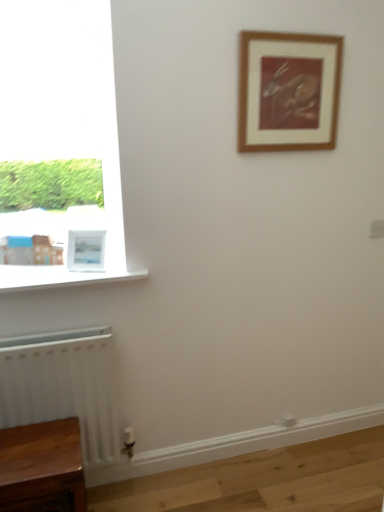
How much space does white matte picture frame at lower left, which is the first picture frame from bottom to top, occupy horizontally?

white matte picture frame at lower left, which is the first picture frame from bottom to top, is 3.53 inches in width.

At what (x,y) coordinates should I click in order to perform the action: click on white matte radiator at lower left. Please return your answer as a coordinate pair (x, y). This screenshot has width=384, height=512. Looking at the image, I should click on (62, 386).

In the scene shown: Measure the distance between wooden table at lower left and camera.

The distance of wooden table at lower left from camera is 4.56 feet.

Identify the location of wooden framed print at upper center, arranged as the 2th picture frame when viewed from the left. (288, 91).

Is wooden framed print at upper center, acting as the first picture frame starting from the top, positioned behind wooden table at lower left?

Yes, it is.

How many degrees apart are the facing directions of wooden framed print at upper center, the first picture frame from the right, and wooden table at lower left?

There is a 0.337-degree angle between the facing directions of wooden framed print at upper center, the first picture frame from the right, and wooden table at lower left.

Who is taller, wooden framed print at upper center, acting as the first picture frame starting from the top, or wooden table at lower left?

wooden table at lower left is taller.

Considering the relative sizes of wooden framed print at upper center, acting as the first picture frame starting from the top, and wooden table at lower left in the image provided, is wooden framed print at upper center, acting as the first picture frame starting from the top, bigger than wooden table at lower left?

Incorrect, wooden framed print at upper center, acting as the first picture frame starting from the top, is not larger than wooden table at lower left.

Measure the distance between white matte radiator at lower left and white glossy window sill at lower left.

white matte radiator at lower left is 14.60 inches from white glossy window sill at lower left.

Would you say white glossy window sill at lower left is part of white matte radiator at lower left's contents?

No, white glossy window sill at lower left is not a part of white matte radiator at lower left.

Is white matte radiator at lower left oriented towards white glossy window sill at lower left?

No, white matte radiator at lower left is not facing towards white glossy window sill at lower left.

How much distance is there between wooden table at lower left and white matte radiator at lower left?

The distance of wooden table at lower left from white matte radiator at lower left is 20.95 centimeters.

In order to click on furniture directly beneath the white matte radiator at lower left (from a real-world perspective) in this screenshot , I will do `click(42, 468)`.

Who is shorter, wooden table at lower left or white matte radiator at lower left?

wooden table at lower left is shorter.

Based on their positions, is wooden table at lower left located to the left or right of white matte radiator at lower left?

Clearly, wooden table at lower left is on the left of white matte radiator at lower left in the image.

Would you say white matte picture frame at lower left, the second picture frame viewed from the top, is part of white matte radiator at lower left's contents?

No.

Are white matte radiator at lower left and white matte picture frame at lower left, acting as the 1th picture frame starting from the left, beside each other?

No, white matte radiator at lower left is not making contact with white matte picture frame at lower left, acting as the 1th picture frame starting from the left.

Is white matte picture frame at lower left, acting as the 1th picture frame starting from the left, at the back of white matte radiator at lower left?

That's not correct — white matte radiator at lower left is not looking away from white matte picture frame at lower left, acting as the 1th picture frame starting from the left.

How many degrees apart are the facing directions of white matte radiator at lower left and white matte picture frame at lower left, which is the second picture frame from right to left?

The angle between the facing direction of white matte radiator at lower left and the facing direction of white matte picture frame at lower left, which is the second picture frame from right to left, is 21.5 degrees.

Which is more to the left, white matte picture frame at lower left, which is the second picture frame from right to left, or wooden table at lower left?

From the viewer's perspective, wooden table at lower left appears more on the left side.

From the image's perspective, between white matte picture frame at lower left, which is the first picture frame from bottom to top, and wooden table at lower left, which one is located above?

white matte picture frame at lower left, which is the first picture frame from bottom to top, from the image's perspective.

Looking at this image, does white matte picture frame at lower left, which is the second picture frame from right to left, turn towards wooden table at lower left?

No, white matte picture frame at lower left, which is the second picture frame from right to left, is not facing towards wooden table at lower left.

Which of these two, white matte picture frame at lower left, acting as the 1th picture frame starting from the left, or wooden table at lower left, stands taller?

With more height is wooden table at lower left.

Is white matte picture frame at lower left, which is the first picture frame from bottom to top, located within wooden framed print at upper center, arranged as the 2th picture frame when viewed from the left?

No, wooden framed print at upper center, arranged as the 2th picture frame when viewed from the left, does not contain white matte picture frame at lower left, which is the first picture frame from bottom to top.

Considering their positions, is wooden framed print at upper center, acting as the 2th picture frame starting from the bottom, located in front of or behind white matte picture frame at lower left, acting as the 1th picture frame starting from the left?

wooden framed print at upper center, acting as the 2th picture frame starting from the bottom, is in front of white matte picture frame at lower left, acting as the 1th picture frame starting from the left.

From a real-world perspective, relative to white matte picture frame at lower left, which is the second picture frame from right to left, is wooden framed print at upper center, acting as the 2th picture frame starting from the bottom, vertically above or below?

In terms of real-world spatial position, wooden framed print at upper center, acting as the 2th picture frame starting from the bottom, is above white matte picture frame at lower left, which is the second picture frame from right to left.

You are a GUI agent. You are given a task and a screenshot of the screen. Output one action in this format:
    pyautogui.click(x=<x>, y=<y>)
    Task: Click on the picture frame above the white matte picture frame at lower left, which is the first picture frame from bottom to top (from a real-world perspective)
    The height and width of the screenshot is (512, 384).
    Given the screenshot: What is the action you would take?
    pyautogui.click(x=288, y=91)

From the picture: From the image's perspective, is white matte picture frame at lower left, which is the second picture frame from right to left, under wooden framed print at upper center, acting as the 2th picture frame starting from the bottom?

Yes, from the image's perspective, white matte picture frame at lower left, which is the second picture frame from right to left, is below wooden framed print at upper center, acting as the 2th picture frame starting from the bottom.

Does white matte picture frame at lower left, which is the first picture frame from bottom to top, have a greater width compared to wooden framed print at upper center, acting as the 2th picture frame starting from the bottom?

Yes.

Where is `furniture below the wooden framed print at upper center, the first picture frame from the right (from a real-world perspective)`? The height and width of the screenshot is (512, 384). furniture below the wooden framed print at upper center, the first picture frame from the right (from a real-world perspective) is located at coordinates (42, 468).

Where is `window sill behind the white matte radiator at lower left`? window sill behind the white matte radiator at lower left is located at coordinates (57, 277).

From the image, which object appears to be nearer to white glossy window sill at lower left, white matte picture frame at lower left, the second picture frame viewed from the top, or wooden framed print at upper center, acting as the first picture frame starting from the top?

The object closer to white glossy window sill at lower left is white matte picture frame at lower left, the second picture frame viewed from the top.

Estimate the real-world distances between objects in this image. Which object is further from wooden table at lower left, white matte radiator at lower left or white matte picture frame at lower left, which is the first picture frame from bottom to top?

white matte picture frame at lower left, which is the first picture frame from bottom to top, is positioned further to the anchor wooden table at lower left.

From the image, which object appears to be farther from wooden framed print at upper center, the first picture frame from the right, wooden table at lower left or white glossy window sill at lower left?

The object further to wooden framed print at upper center, the first picture frame from the right, is wooden table at lower left.

Based on their spatial positions, is wooden table at lower left or white matte radiator at lower left closer to white matte picture frame at lower left, acting as the 1th picture frame starting from the left?

A: white matte radiator at lower left is closer to white matte picture frame at lower left, acting as the 1th picture frame starting from the left.

Which object lies nearer to the anchor point white matte radiator at lower left, wooden table at lower left or white matte picture frame at lower left, the second picture frame viewed from the top?

wooden table at lower left is closer to white matte radiator at lower left.

When comparing their distances from white matte radiator at lower left, does wooden framed print at upper center, acting as the first picture frame starting from the top, or white matte picture frame at lower left, the second picture frame viewed from the top, seem further?

wooden framed print at upper center, acting as the first picture frame starting from the top, is positioned further to the anchor white matte radiator at lower left.

Consider the image. Considering their positions, is white matte radiator at lower left positioned further to wooden framed print at upper center, acting as the 2th picture frame starting from the bottom, than white matte picture frame at lower left, the second picture frame viewed from the top?

Among the two, white matte radiator at lower left is located further to wooden framed print at upper center, acting as the 2th picture frame starting from the bottom.

Estimate the real-world distances between objects in this image. Which object is closer to wooden table at lower left, wooden framed print at upper center, acting as the first picture frame starting from the top, or white matte picture frame at lower left, acting as the 1th picture frame starting from the left?

white matte picture frame at lower left, acting as the 1th picture frame starting from the left, is closer to wooden table at lower left.

At what (x,y) coordinates should I click in order to perform the action: click on radiator between white matte picture frame at lower left, which is the second picture frame from right to left, and wooden table at lower left, in the vertical direction. Please return your answer as a coordinate pair (x, y). This screenshot has height=512, width=384. Looking at the image, I should click on (62, 386).

Find the location of a particular element. The image size is (384, 512). window sill between wooden framed print at upper center, the first picture frame from the right, and wooden table at lower left, in the vertical direction is located at coordinates (57, 277).

The image size is (384, 512). I want to click on radiator that lies between white glossy window sill at lower left and wooden table at lower left from top to bottom, so click(x=62, y=386).

Locate an element on the screen. window sill between wooden framed print at upper center, arranged as the 2th picture frame when viewed from the left, and white matte radiator at lower left in the up-down direction is located at coordinates (57, 277).